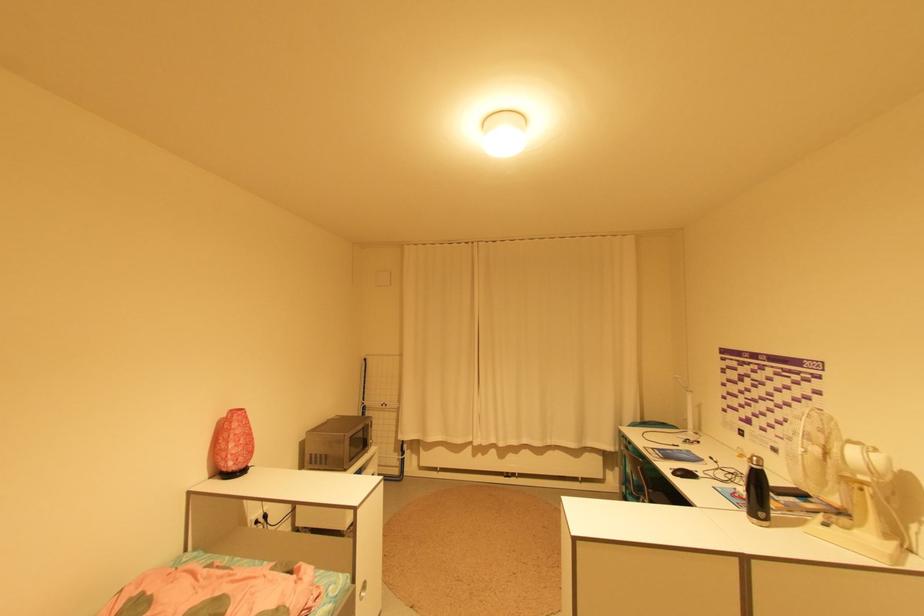
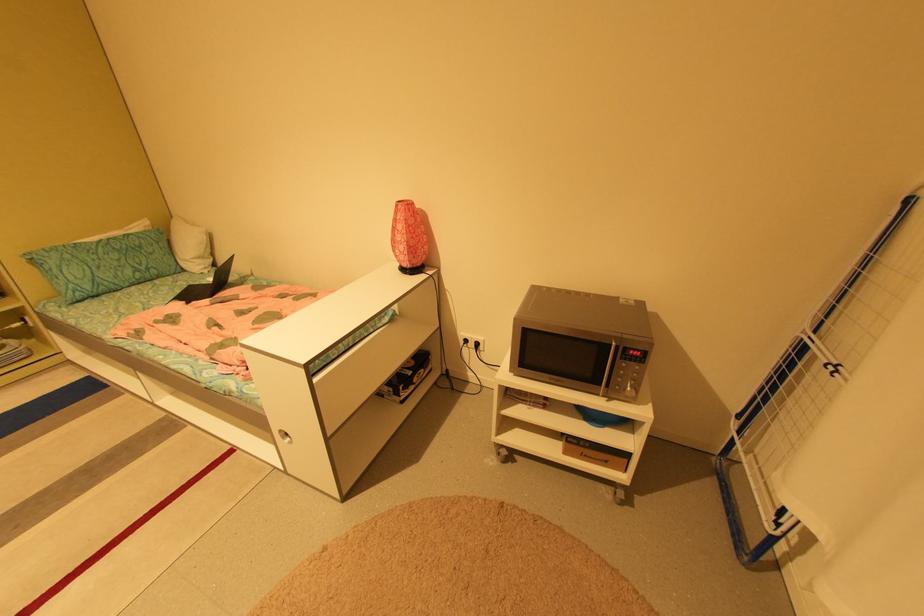
Locate, in the second image, the point that corresponds to pixel 237 411 in the first image.

(406, 201)